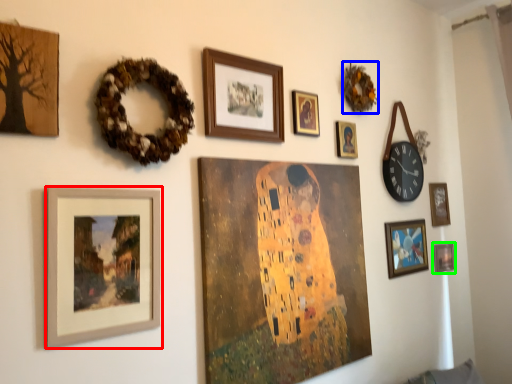
Question: Which object is the closest to the picture frame (highlighted by a red box)? Choose among these: decor (highlighted by a blue box) or picture frame (highlighted by a green box).

Choices:
 (A) decor
 (B) picture frame

Answer: (A)